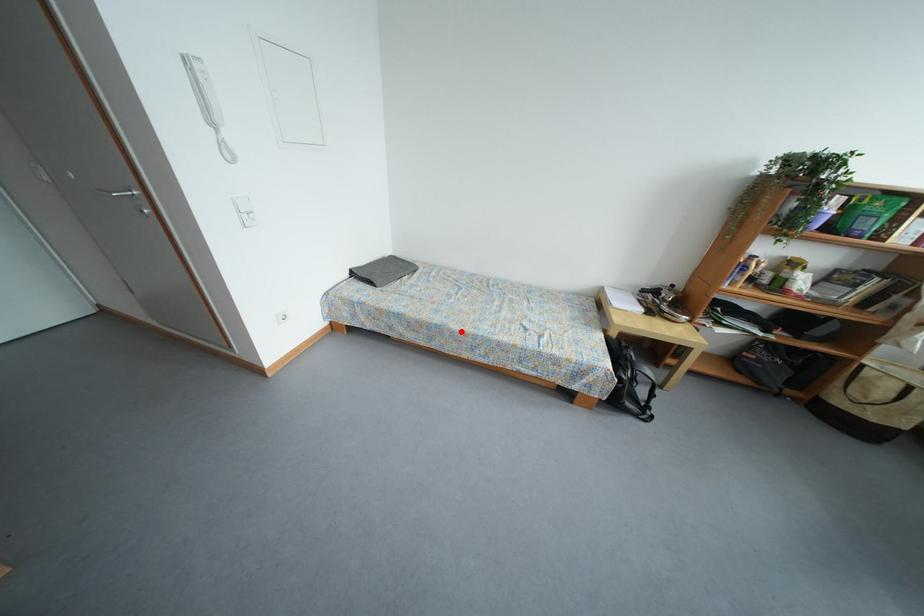
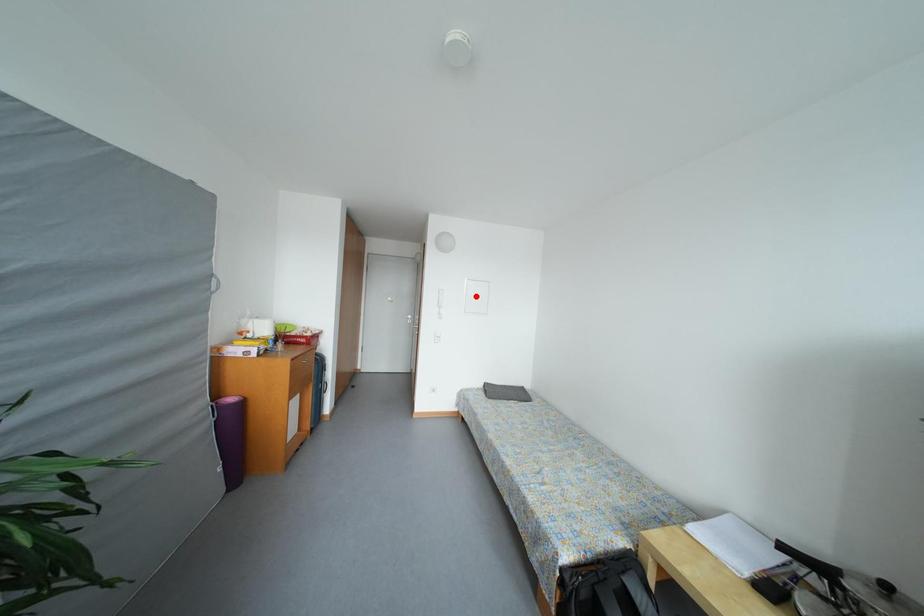
I am providing you with two images of the same scene from different viewpoints. A red point is marked on the first image and another point is marked on the second image. Does the point marked in image1 correspond to the same location as the one in image2?

No